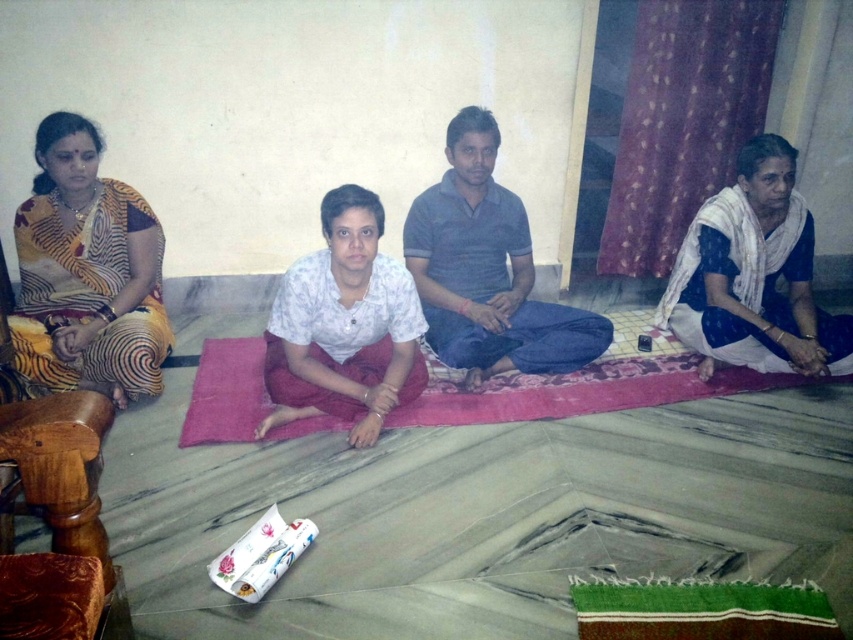
Is point (18, 314) positioned in front of point (436, 394)?

That is True.

Is yellow and brown sari at left further to camera compared to red fabric mat at center?

No, it is in front of red fabric mat at center.

In the scene shown: Who is more forward, (25, 268) or (608, 378)?

Point (25, 268) is in front.

Where is `yellow and brown sari at left`? The width and height of the screenshot is (853, 640). yellow and brown sari at left is located at coordinates (86, 273).

How far apart are white cotton saree at right and red fabric mat at center?

A distance of 18.33 inches exists between white cotton saree at right and red fabric mat at center.

Between point (849, 339) and point (646, 388), which one is positioned behind?

Positioned behind is point (646, 388).

Is point (747, 304) positioned behind point (242, 408)?

Yes, it is.

At what (x,y) coordinates should I click in order to perform the action: click on white cotton saree at right. Please return your answer as a coordinate pair (x, y). This screenshot has height=640, width=853. Looking at the image, I should click on (753, 275).

Can you confirm if white cotton saree at right is positioned below white cotton shirt at center?

No, white cotton saree at right is not below white cotton shirt at center.

Locate an element on the screen. Image resolution: width=853 pixels, height=640 pixels. white cotton saree at right is located at coordinates pos(753,275).